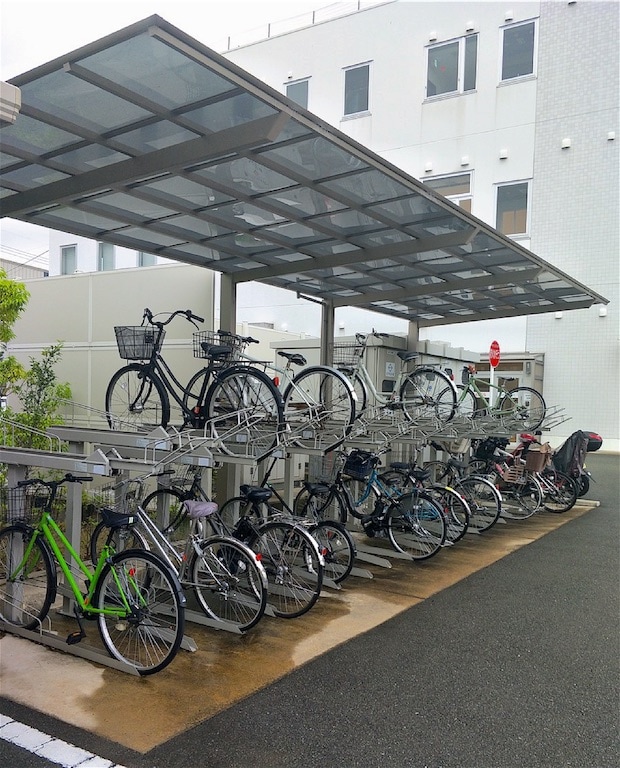
You are a GUI agent. You are given a task and a screenshot of the screen. Output one action in this format:
    pyautogui.click(x=<x>, y=<y>)
    Task: Click on the windows
    This screenshot has width=620, height=768.
    Given the screenshot: What is the action you would take?
    pyautogui.click(x=510, y=58), pyautogui.click(x=436, y=68), pyautogui.click(x=355, y=78), pyautogui.click(x=304, y=84), pyautogui.click(x=495, y=204), pyautogui.click(x=144, y=253), pyautogui.click(x=110, y=256), pyautogui.click(x=73, y=260)